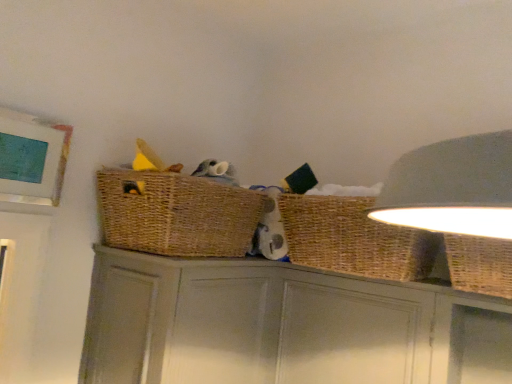
Question: Is woven wicker basket at upper right, which is counted as the first basket, starting from the right, placed right next to woven wicker basket at right, which is the second basket in right-to-left order?

Choices:
 (A) no
 (B) yes

Answer: (A)

Question: Does woven wicker basket at upper right, which is counted as the first basket, starting from the right, have a greater height compared to woven wicker basket at right, which is the second basket in right-to-left order?

Choices:
 (A) yes
 (B) no

Answer: (B)

Question: Does woven wicker basket at upper right, acting as the second basket starting from the left, contain woven wicker basket at right, which is the second basket in right-to-left order?

Choices:
 (A) yes
 (B) no

Answer: (B)

Question: Is woven wicker basket at upper right, acting as the second basket starting from the left, facing towards woven wicker basket at right, which is the second basket in right-to-left order?

Choices:
 (A) yes
 (B) no

Answer: (B)

Question: From a real-world perspective, is woven wicker basket at upper right, acting as the second basket starting from the left, physically above woven wicker basket at right, the first basket from the left?

Choices:
 (A) no
 (B) yes

Answer: (A)

Question: From a real-world perspective, relative to woven brown basket at upper center, is woven wicker basket at upper right, which is counted as the first basket, starting from the right, vertically above or below?

Choices:
 (A) above
 (B) below

Answer: (B)

Question: In the image, is woven wicker basket at upper right, which is counted as the first basket, starting from the right, positioned in front of or behind woven brown basket at upper center?

Choices:
 (A) front
 (B) behind

Answer: (A)

Question: Is point (503, 258) positioned closer to the camera than point (229, 185)?

Choices:
 (A) farther
 (B) closer

Answer: (B)

Question: Considering the positions of woven wicker basket at upper right, acting as the second basket starting from the left, and woven brown basket at upper center in the image, is woven wicker basket at upper right, acting as the second basket starting from the left, bigger or smaller than woven brown basket at upper center?

Choices:
 (A) small
 (B) big

Answer: (A)

Question: Would you say woven brown basket at upper center is to the left or to the right of woven wicker basket at upper right, acting as the second basket starting from the left, in the picture?

Choices:
 (A) left
 (B) right

Answer: (A)

Question: Is woven brown basket at upper center bigger or smaller than woven wicker basket at upper right, which is counted as the first basket, starting from the right?

Choices:
 (A) small
 (B) big

Answer: (B)

Question: From the image's perspective, relative to woven wicker basket at upper right, which is counted as the first basket, starting from the right, is woven brown basket at upper center above or below?

Choices:
 (A) above
 (B) below

Answer: (A)

Question: Is woven brown basket at upper center wider or thinner than woven wicker basket at upper right, acting as the second basket starting from the left?

Choices:
 (A) thin
 (B) wide

Answer: (B)

Question: Is woven brown basket at upper center inside or outside of matte gray cabinet at center?

Choices:
 (A) inside
 (B) outside

Answer: (B)

Question: From the image's perspective, is woven brown basket at upper center positioned above or below matte gray cabinet at center?

Choices:
 (A) above
 (B) below

Answer: (A)